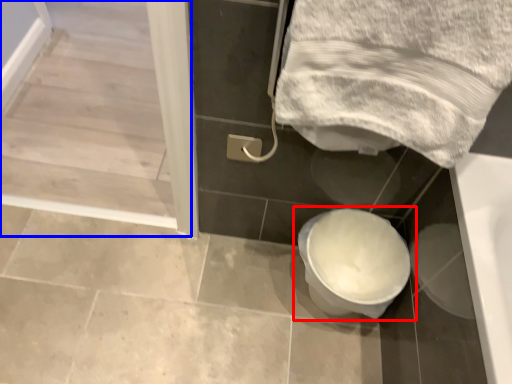
Question: Which object is closer to the camera taking this photo, toilet (highlighted by a red box) or screen door (highlighted by a blue box)?

Choices:
 (A) toilet
 (B) screen door

Answer: (A)